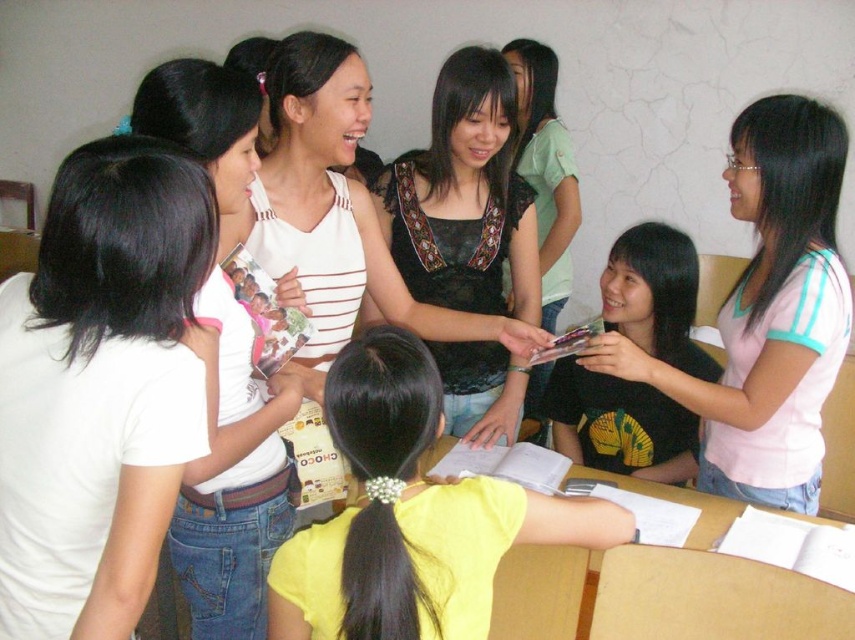
Question: Among these objects, which one is nearest to the camera?

Choices:
 (A) white matte shirt at upper left
 (B) white striped tank top at upper left
 (C) yellow printed shirt at center

Answer: (A)

Question: Is black lace top at center wider than yellow printed shirt at center?

Choices:
 (A) yes
 (B) no

Answer: (B)

Question: Is white striped tank top at upper left closer to the viewer compared to black lace top at center?

Choices:
 (A) no
 (B) yes

Answer: (B)

Question: Among these objects, which one is farthest from the camera?

Choices:
 (A) white matte shirt at upper left
 (B) yellow printed shirt at center

Answer: (B)

Question: Which of the following is the closest to the observer?

Choices:
 (A) (506, 129)
 (B) (429, 387)

Answer: (B)

Question: Where is white matte shirt at upper left located in relation to black lace top at center in the image?

Choices:
 (A) above
 (B) below

Answer: (B)